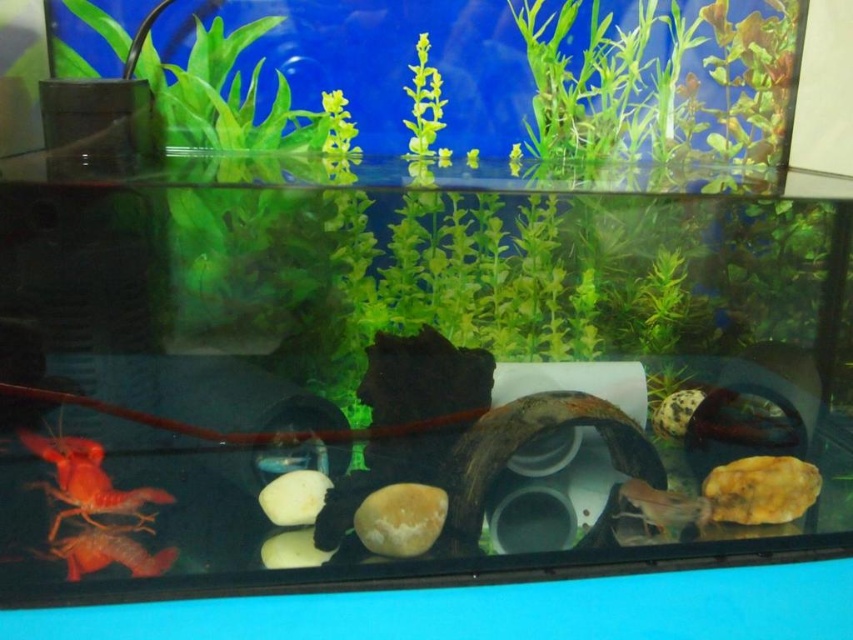
Between point (267, 259) and point (80, 570), which one is positioned in front?

Positioned in front is point (80, 570).

You are a GUI agent. You are given a task and a screenshot of the screen. Output one action in this format:
    pyautogui.click(x=<x>, y=<y>)
    Task: Click on the green matte plant at upper center
    This screenshot has height=640, width=853.
    Given the screenshot: What is the action you would take?
    pyautogui.click(x=184, y=106)

I want to click on green matte plant at upper center, so click(184, 106).

Is matte orange shrimp at lower left smaller than translucent glass shrimp at center?

Actually, matte orange shrimp at lower left might be larger than translucent glass shrimp at center.

Who is more forward, (157,573) or (622,493)?

Point (157,573) is in front.

Find the location of `matte orange shrimp at lower left`. matte orange shrimp at lower left is located at coordinates (109, 554).

Based on the photo, can you confirm if green matte plant at upper center is wider than translucent glass shrimp at center?

Yes.

Can you confirm if green matte plant at upper center is positioned above translucent glass shrimp at center?

Yes, green matte plant at upper center is above translucent glass shrimp at center.

Identify the location of green matte plant at upper center. The image size is (853, 640). [184, 106].